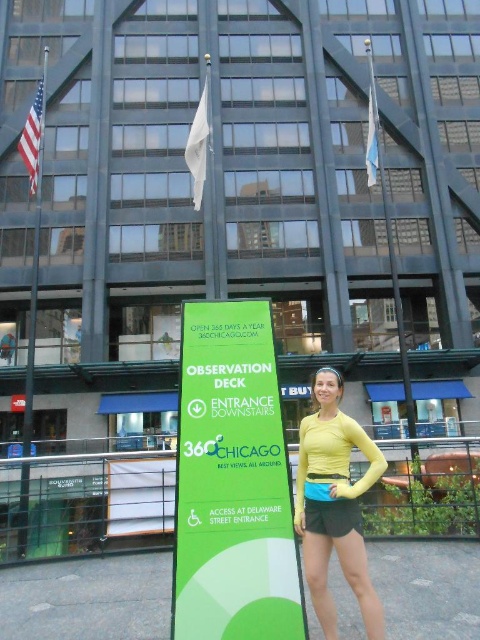
You are standing at the entrance of the building and see two points marked in the image. The first point is at coordinates point (263, 372) and the second is at point (36, 253). Which point is closer to your current position?

The point at coordinates point (263, 372) is closer to your current position because it is closer to the camera than point (36, 253).

What is located at the point with coordinates (232,483)?

The green matte sign at center is located at point (232,483).